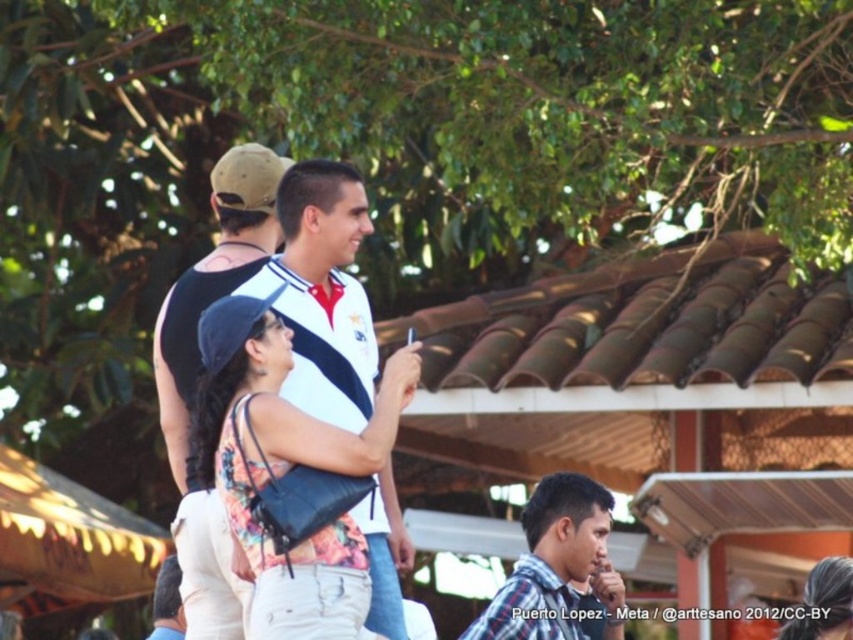
Between black matte tank top at center and plaid cotton shirt at center, which one has more height?

black matte tank top at center

Based on the photo, who is shorter, black matte tank top at center or plaid cotton shirt at center?

With less height is plaid cotton shirt at center.

Which is behind, point (172, 433) or point (526, 627)?

The point (526, 627) is behind.

Locate an element on the screen. black matte tank top at center is located at coordinates (213, 282).

Between floral fabric top at center and plaid cotton shirt at center, which one has more height?

floral fabric top at center is taller.

How distant is floral fabric top at center from plaid cotton shirt at center?

floral fabric top at center and plaid cotton shirt at center are 8.99 meters apart.

What do you see at coordinates (286, 468) in the screenshot? I see `floral fabric top at center` at bounding box center [286, 468].

The width and height of the screenshot is (853, 640). What are the coordinates of `floral fabric top at center` in the screenshot? It's located at (286, 468).

Is floral fabric top at center to the right of black matte tank top at center from the viewer's perspective?

Correct, you'll find floral fabric top at center to the right of black matte tank top at center.

Which is below, floral fabric top at center or black matte tank top at center?

Positioned lower is floral fabric top at center.

Measure the distance between point (367, 563) and camera.

Point (367, 563) and camera are 133.41 feet apart.

Where is `floral fabric top at center`? The height and width of the screenshot is (640, 853). floral fabric top at center is located at coordinates (286, 468).